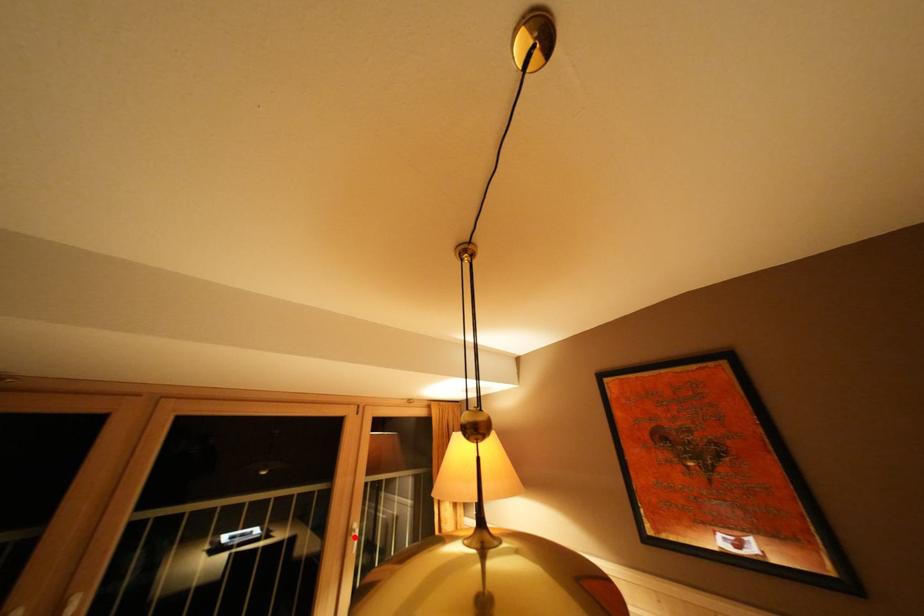
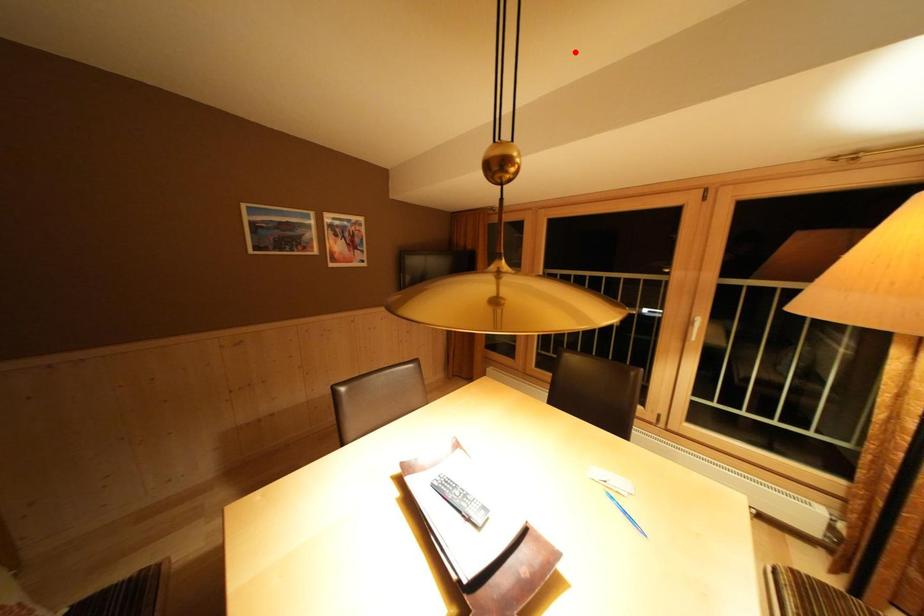
Consider the image. I am providing you with two images of the same scene from different viewpoints. A red point is marked on the first image and another point is marked on the second image. Are the points marked in image1 and image2 representing the same 3D position?

No